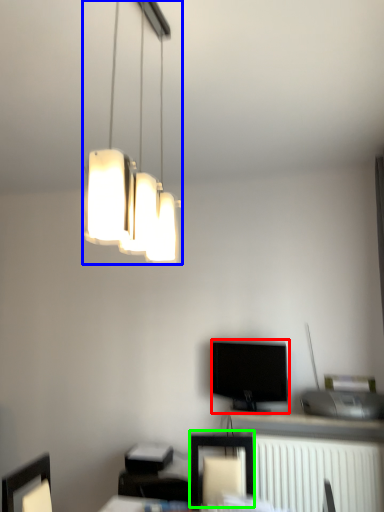
Question: Which is nearer to the television (highlighted by a red box)? lamp (highlighted by a blue box) or furniture (highlighted by a green box).

Choices:
 (A) lamp
 (B) furniture

Answer: (B)